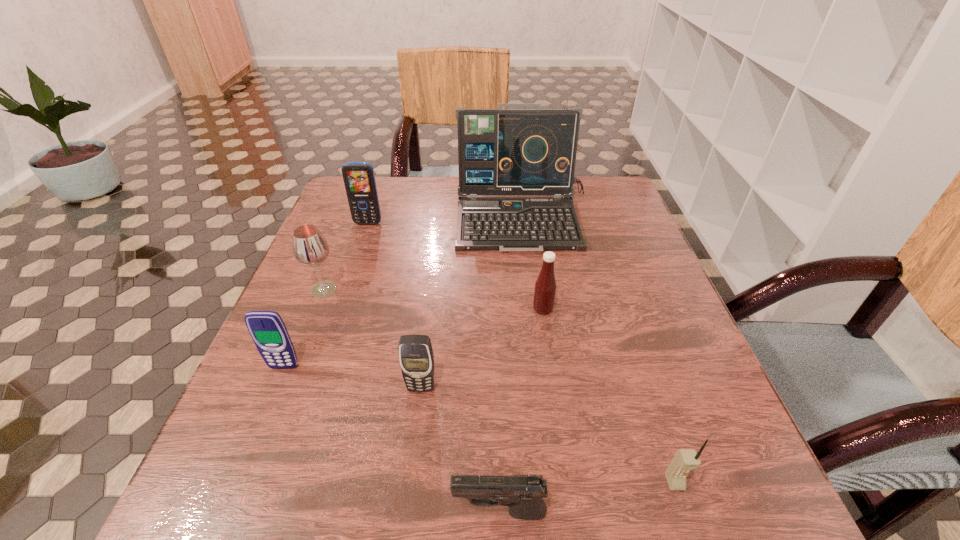
Where is `laptop computer`? The image size is (960, 540). laptop computer is located at coordinates (501, 151).

Locate an element on the screen. The image size is (960, 540). the tallest cellular telephone is located at coordinates (359, 179).

Locate an element on the screen. The width and height of the screenshot is (960, 540). wineglass is located at coordinates (310, 248).

What are the coordinates of `the fifth nearest object` in the screenshot? It's located at (545, 286).

The image size is (960, 540). In order to click on the fourth nearest object in this screenshot , I will do `click(267, 329)`.

Where is `the fifth object from right to left`? This screenshot has height=540, width=960. the fifth object from right to left is located at coordinates (416, 357).

Identify the location of the second nearest cellular telephone. (416, 357).

In order to click on the rightmost cellular telephone in this screenshot , I will do `click(685, 460)`.

At what (x,y) coordinates should I click in order to perform the action: click on the nearest cellular telephone. Please return your answer as a coordinate pair (x, y). This screenshot has height=540, width=960. Looking at the image, I should click on (685, 460).

Where is `pistol`? The height and width of the screenshot is (540, 960). pistol is located at coordinates (523, 494).